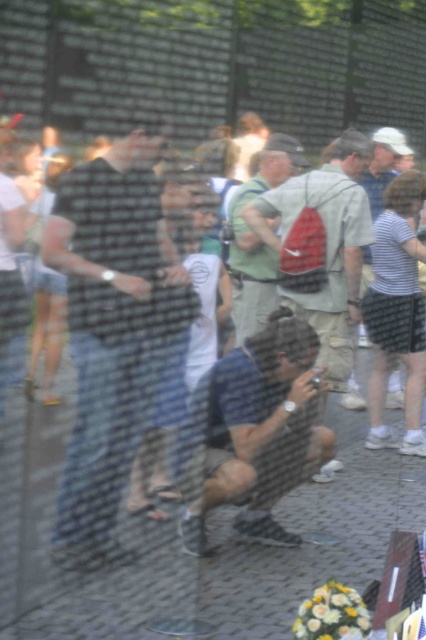
Between dark plaid shirt at center and red backpack at center, which one has more height?

With more height is dark plaid shirt at center.

Does point (81, 520) lie in front of point (359, 312)?

Yes, point (81, 520) is in front of point (359, 312).

Image resolution: width=426 pixels, height=640 pixels. In order to click on dark plaid shirt at center in this screenshot , I will do `click(109, 332)`.

Is dark plaid shirt at center smaller than green fabric backpack at center?

No.

Which is above, dark plaid shirt at center or green fabric backpack at center?

green fabric backpack at center is higher up.

You are a GUI agent. You are given a task and a screenshot of the screen. Output one action in this format:
    pyautogui.click(x=<x>, y=<y>)
    Task: Click on the dark plaid shirt at center
    The height and width of the screenshot is (640, 426).
    Given the screenshot: What is the action you would take?
    pyautogui.click(x=109, y=332)

Identify the location of dark plaid shirt at center. Image resolution: width=426 pixels, height=640 pixels. (x=109, y=332).

From the picture: Can you confirm if red backpack at center is positioned to the right of green fabric backpack at center?

Correct, you'll find red backpack at center to the right of green fabric backpack at center.

Is the position of red backpack at center more distant than that of green fabric backpack at center?

That is True.

Does point (316, 316) come farther from viewer compared to point (273, 227)?

That is True.

At what (x,y) coordinates should I click in order to perform the action: click on red backpack at center. Please return your answer as a coordinate pair (x, y). Looking at the image, I should click on (324, 246).